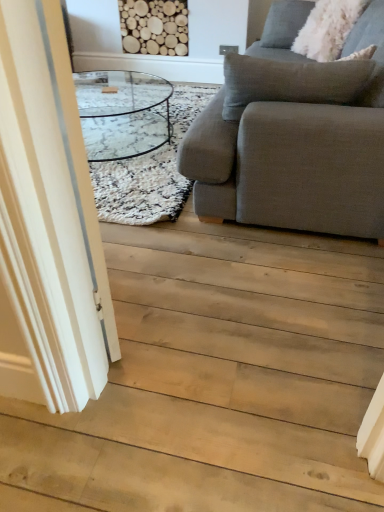
Question: Based on their sizes in the image, would you say transparent glass door at left is bigger or smaller than white fluffy pillow at upper right?

Choices:
 (A) big
 (B) small

Answer: (A)

Question: Considering the positions of transparent glass door at left and white fluffy pillow at upper right in the image, is transparent glass door at left taller or shorter than white fluffy pillow at upper right?

Choices:
 (A) short
 (B) tall

Answer: (B)

Question: Estimate the real-world distances between objects in this image. Which object is farther from the transparent glass door at left?

Choices:
 (A) white fluffy pillow at upper right
 (B) gray fabric couch at right
 (C) white shaggy rug at center

Answer: (A)

Question: Estimate the real-world distances between objects in this image. Which object is closer to the gray fabric couch at right?

Choices:
 (A) white shaggy rug at center
 (B) transparent glass door at left
 (C) white fluffy pillow at upper right

Answer: (A)